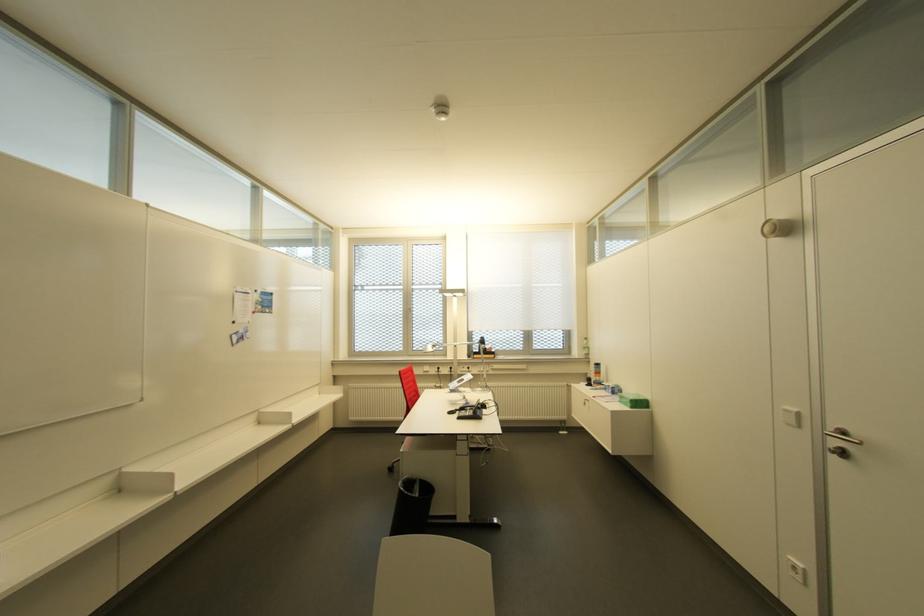
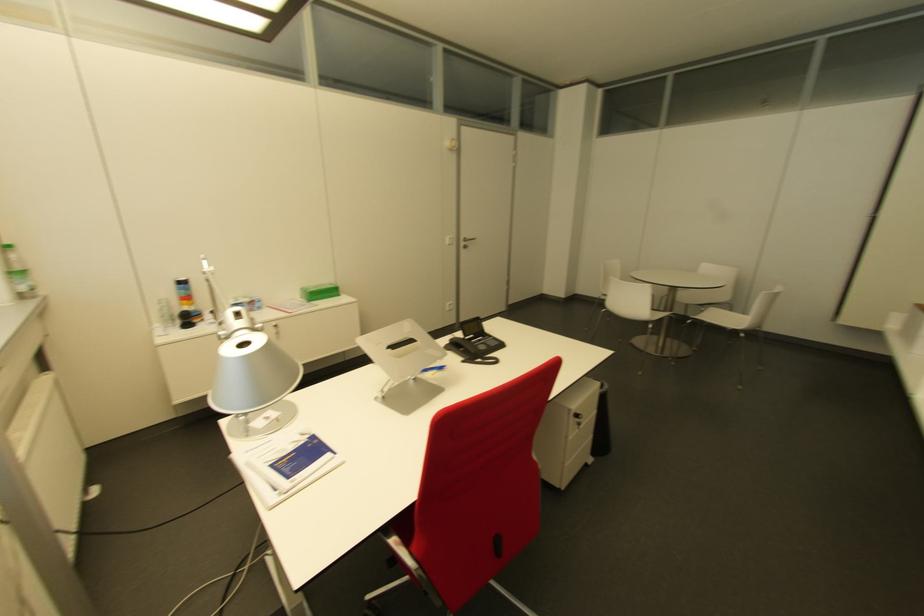
Locate, in the second image, the point that corresponds to point 582,352 in the first image.

(27, 284)